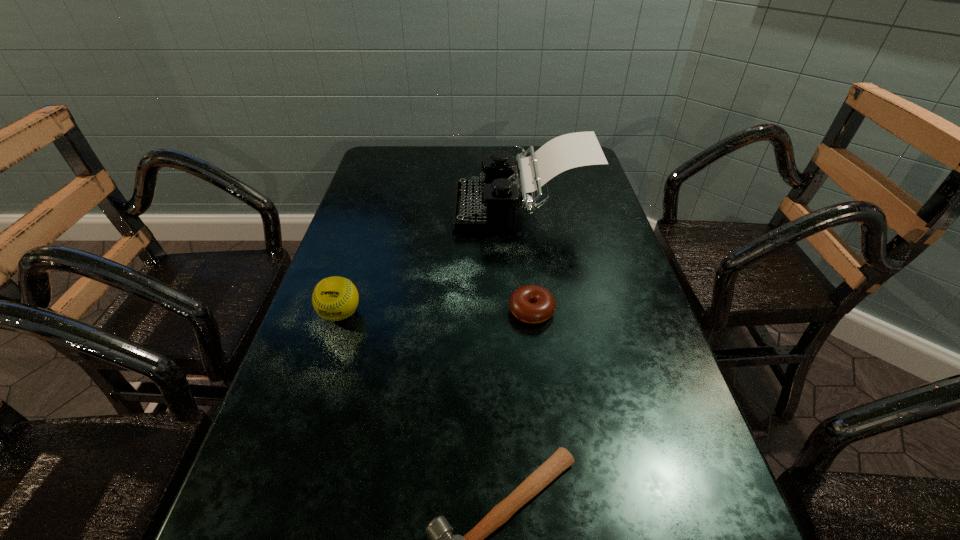
Locate an element on the screen. object present at the left edge is located at coordinates (335, 298).

Image resolution: width=960 pixels, height=540 pixels. I want to click on object that is positioned at the right edge, so click(x=479, y=205).

In order to click on free space at the far edge in this screenshot , I will do `click(421, 161)`.

Locate an element on the screen. The image size is (960, 540). blank space at the left edge of the desktop is located at coordinates (394, 268).

At what (x,y) coordinates should I click in order to perform the action: click on vacant area at the right edge of the desktop. Please return your answer as a coordinate pair (x, y). The height and width of the screenshot is (540, 960). Looking at the image, I should click on (584, 329).

Image resolution: width=960 pixels, height=540 pixels. I want to click on free space at the far left corner of the desktop, so click(413, 147).

In the image, there is a desktop. Identify the location of blank space at the far right corner. (565, 177).

Where is `vacant area that lies between the doughnut and the typewriter`? vacant area that lies between the doughnut and the typewriter is located at coordinates (526, 259).

What are the coordinates of `free point between the leftmost object and the second shortest object` in the screenshot? It's located at (436, 313).

This screenshot has height=540, width=960. In order to click on free space between the third tallest object and the farthest object in this screenshot , I will do `click(526, 259)`.